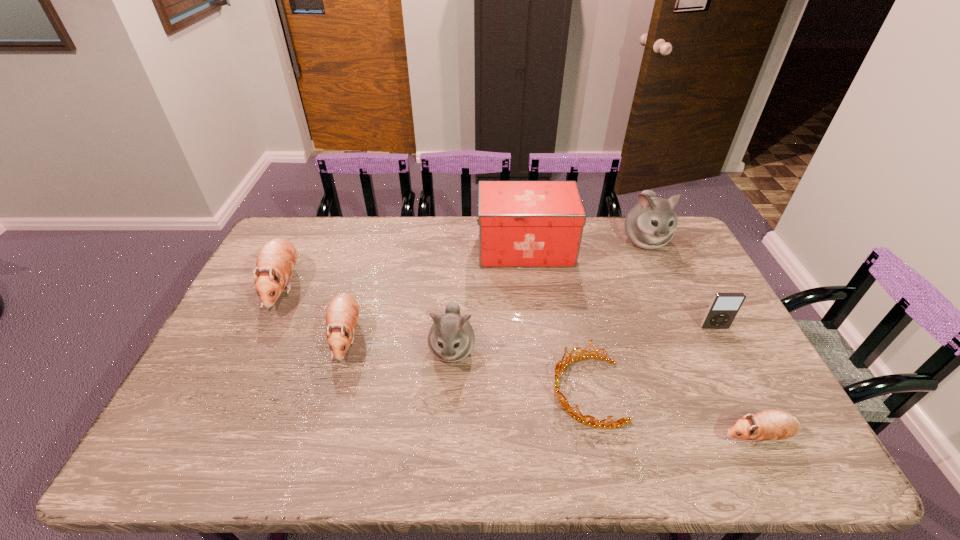
Find the location of a particular element. The image size is (960, 540). tiara is located at coordinates (622, 421).

Locate an element on the screen. the smallest brown hamster is located at coordinates (771, 424).

At what (x,y) coordinates should I click in order to perform the action: click on the shortest hamster. Please return your answer as a coordinate pair (x, y). Looking at the image, I should click on (771, 424).

At what (x,y) coordinates should I click in order to perform the action: click on free spot located 0.340m on the handle side of the first-aid kit. Please return your answer as a coordinate pair (x, y). Image resolution: width=960 pixels, height=540 pixels. Looking at the image, I should click on (382, 249).

Find the location of a particular element. The image size is (960, 540). vacant space located on the handle side of the first-aid kit is located at coordinates (401, 249).

You are a GUI agent. You are given a task and a screenshot of the screen. Output one action in this format:
    pyautogui.click(x=<x>, y=<y>)
    Task: Click on the free region located 0.360m on the handle side of the first-aid kit
    The image size is (960, 540).
    Given the screenshot: What is the action you would take?
    pyautogui.click(x=376, y=249)

Where is `vacant space situated 0.310m on the face of the tallest hamster`? The height and width of the screenshot is (540, 960). vacant space situated 0.310m on the face of the tallest hamster is located at coordinates (685, 328).

In order to click on vacant space located on the face of the third hamster from left to right in this screenshot , I will do `click(449, 392)`.

Image resolution: width=960 pixels, height=540 pixels. In order to click on blank area located at the face of the biggest brown hamster in this screenshot , I will do `click(260, 334)`.

Locate an element on the screen. The width and height of the screenshot is (960, 540). vacant region located 0.150m on the front-facing side of the iPod is located at coordinates (737, 372).